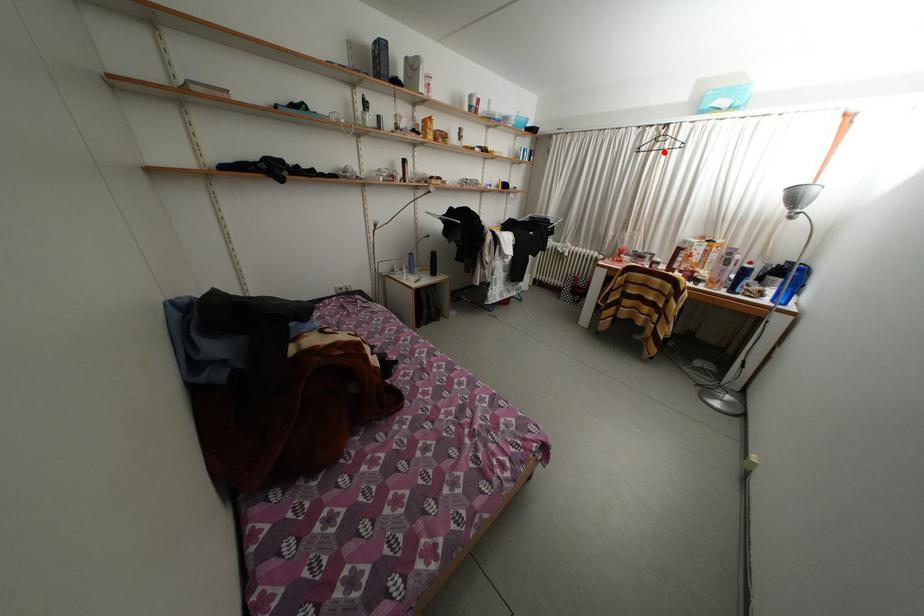
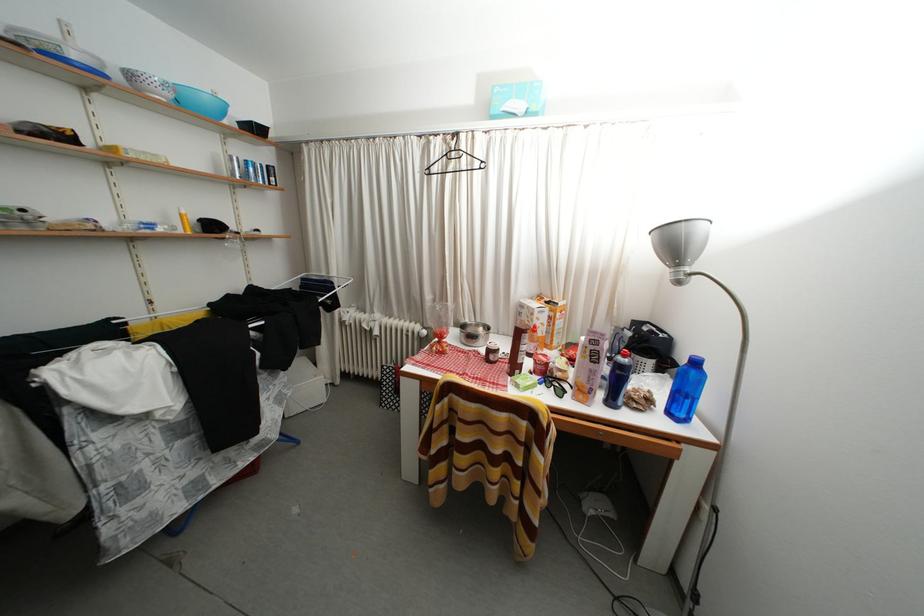
In the second image, find the point that corresponds to the highlighted location in the first image.

(458, 172)